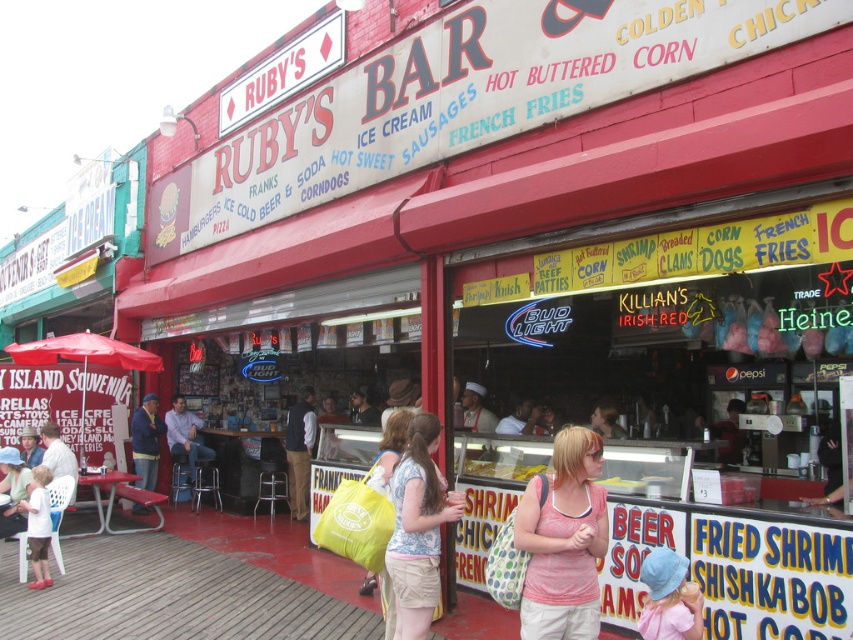
Between pink cotton tank top at center and golden fried shrimp at center, which one appears on the left side from the viewer's perspective?

Positioned to the left is golden fried shrimp at center.

Is pink cotton tank top at center further to camera compared to golden fried shrimp at center?

No, pink cotton tank top at center is in front of golden fried shrimp at center.

Between point (604, 497) and point (474, 465), which one is positioned in front?

Point (604, 497) is in front.

Identify the location of pink cotton tank top at center. This screenshot has height=640, width=853. (563, 541).

Does light blue denim shorts at center appear under blue denim jacket at lower left?

No.

Is light blue denim shorts at center taller than blue denim jacket at lower left?

Yes.

Locate an element on the screen. The image size is (853, 640). light blue denim shorts at center is located at coordinates (416, 529).

Which is behind, point (299, 518) or point (164, 417)?

The point (164, 417) is behind.

Is point (299, 429) in front of point (199, 458)?

Yes, it is.

What do you see at coordinates (299, 451) in the screenshot? This screenshot has width=853, height=640. I see `dark blue jeans at center` at bounding box center [299, 451].

The height and width of the screenshot is (640, 853). Find the location of `dark blue jeans at center`. dark blue jeans at center is located at coordinates tap(299, 451).